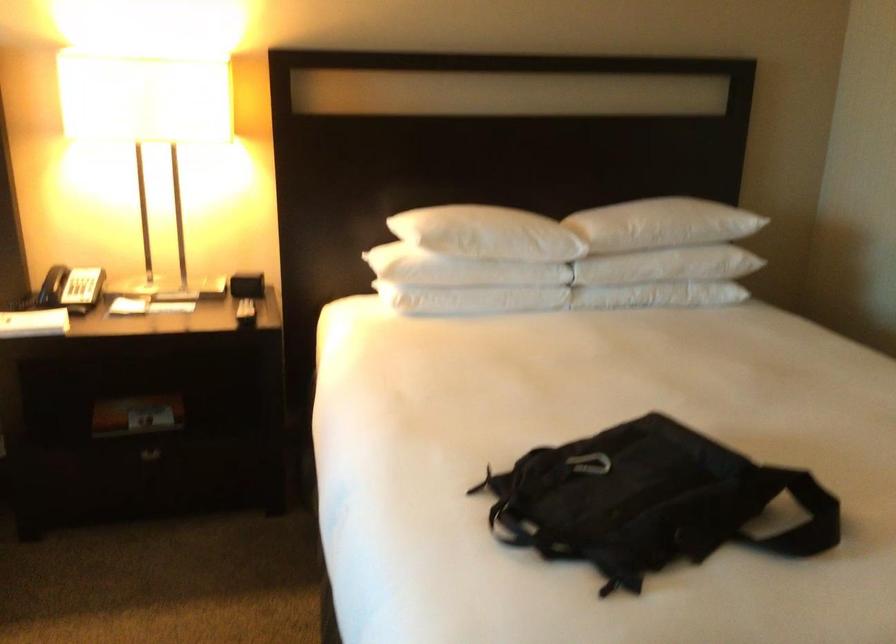
What do you see at coordinates (52, 285) in the screenshot?
I see `a telephone handset` at bounding box center [52, 285].